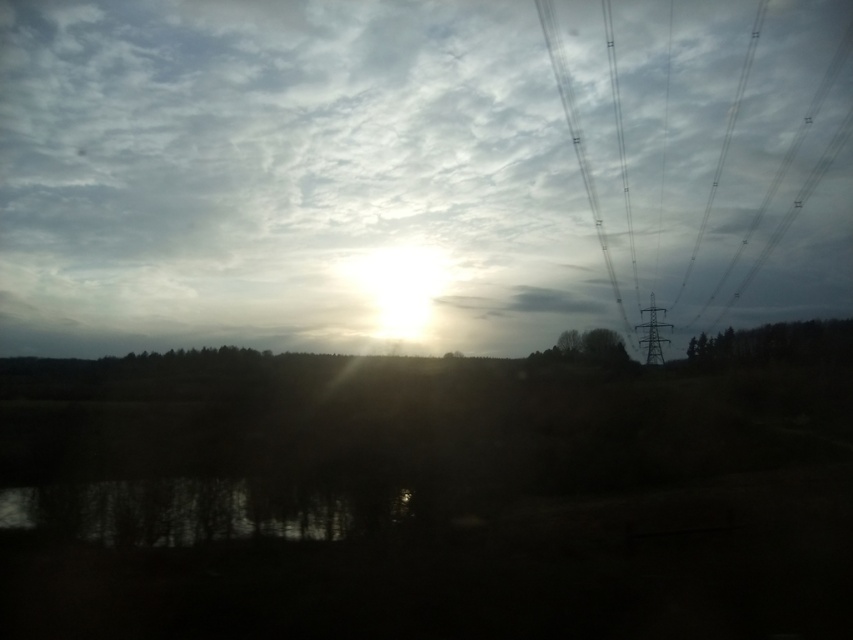
Question: Based on their relative distances, which object is farther from the metallic wires at upper right?

Choices:
 (A) white fluffy cloud at upper center
 (B) transparent glass water at bottom left

Answer: (B)

Question: Which object is farther from the camera taking this photo?

Choices:
 (A) white fluffy cloud at upper center
 (B) metallic wire at upper right

Answer: (B)

Question: Can you confirm if transparent glass water at bottom left is bigger than metallic wire at right?

Choices:
 (A) no
 (B) yes

Answer: (A)

Question: Is transparent glass water at bottom left to the left of clear wire at upper right from the viewer's perspective?

Choices:
 (A) no
 (B) yes

Answer: (B)

Question: Does transparent glass water at bottom left come behind metallic wire at right?

Choices:
 (A) yes
 (B) no

Answer: (B)

Question: Which object appears closest to the camera in this image?

Choices:
 (A) metallic wire at right
 (B) white fluffy cloud at upper center

Answer: (B)